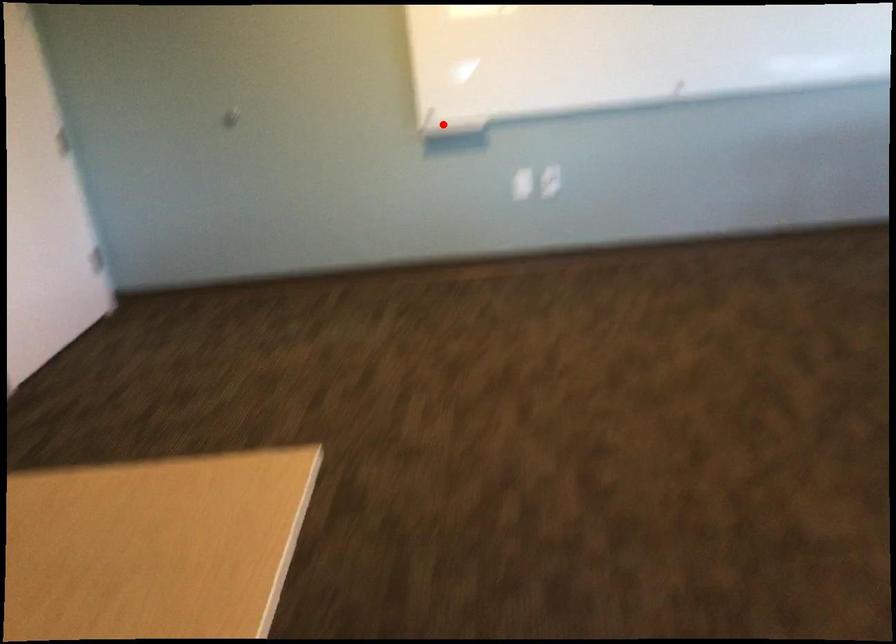
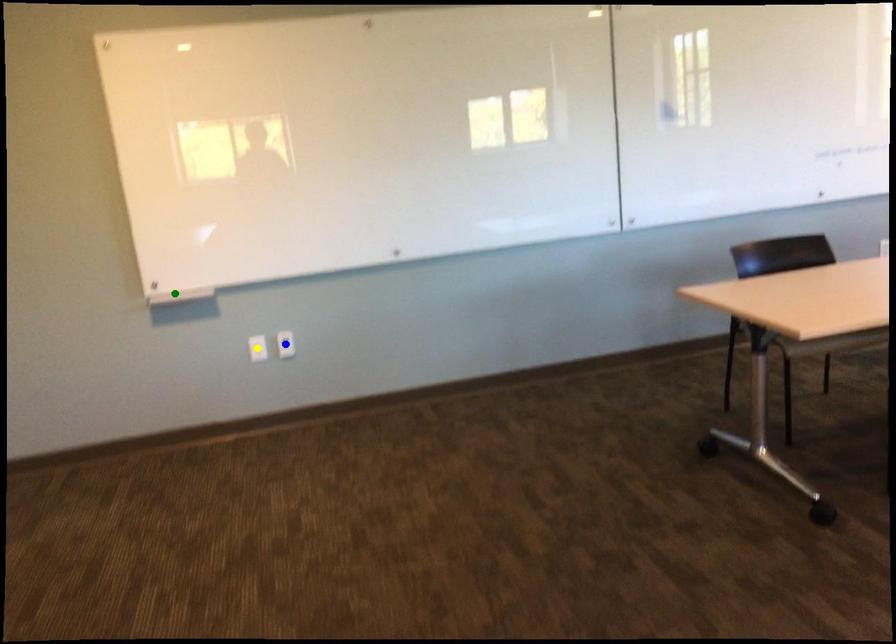
Question: I am providing you with two images of the same scene from different viewpoints. A red point is marked on the first image. You are given multiple points on the second image. Which point in image 2 is actually the same real-world point as the red point in image 1?

Choices:
 (A) green point
 (B) yellow point
 (C) blue point

Answer: (A)